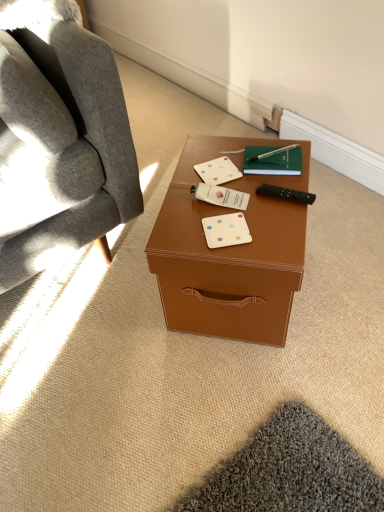
This screenshot has width=384, height=512. What are the coordinates of `free spot to the left of black plastic remote control at right` in the screenshot? It's located at (218, 207).